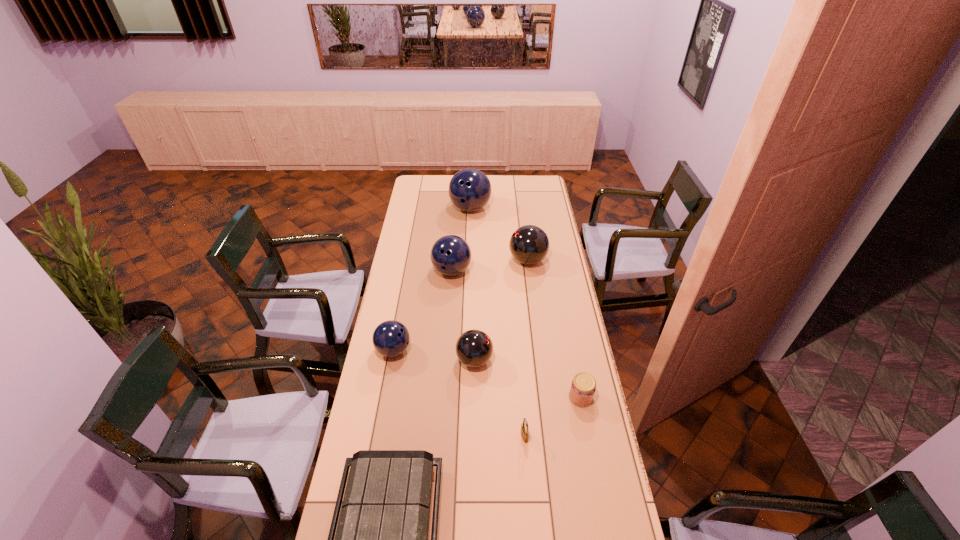
The width and height of the screenshot is (960, 540). What are the coordinates of `free space that is in between the leftmost blue bowling ball and the second nearest blue bowling ball` in the screenshot? It's located at (422, 310).

This screenshot has height=540, width=960. In order to click on vacant space that's between the red jam and the rightmost bowling ball in this screenshot , I will do `click(554, 329)`.

Image resolution: width=960 pixels, height=540 pixels. I want to click on vacant point located between the second farthest blue bowling ball and the jam, so click(516, 334).

You are a GUI agent. You are given a task and a screenshot of the screen. Output one action in this format:
    pyautogui.click(x=<x>, y=<y>)
    Task: Click on the empty location between the farthest object and the brass padlock
    The width and height of the screenshot is (960, 540).
    Given the screenshot: What is the action you would take?
    pyautogui.click(x=497, y=322)

Find the location of `free point between the second nearest blue bowling ball and the smaller black bowling ball`. free point between the second nearest blue bowling ball and the smaller black bowling ball is located at coordinates (463, 315).

Select which object is the seventh closest to the second smallest blue bowling ball. Please provide its 2D coordinates. Your answer should be formatted as a tuple, i.e. [(x, y)], where the tuple contains the x and y coordinates of a point satisfying the conditions above.

[(381, 539)]

Select which object appears as the fifth closest to the nearest object. Please provide its 2D coordinates. Your answer should be formatted as a tuple, i.e. [(x, y)], where the tuple contains the x and y coordinates of a point satisfying the conditions above.

[(450, 255)]

Identify the location of the closest bowling ball to the padlock. (474, 348).

Identify which bowling ball is the third nearest to the third nearest object. Please provide its 2D coordinates. Your answer should be formatted as a tuple, i.e. [(x, y)], where the tuple contains the x and y coordinates of a point satisfying the conditions above.

[(529, 244)]

The image size is (960, 540). I want to click on blue bowling ball that is the closest to the radio receiver, so click(x=391, y=338).